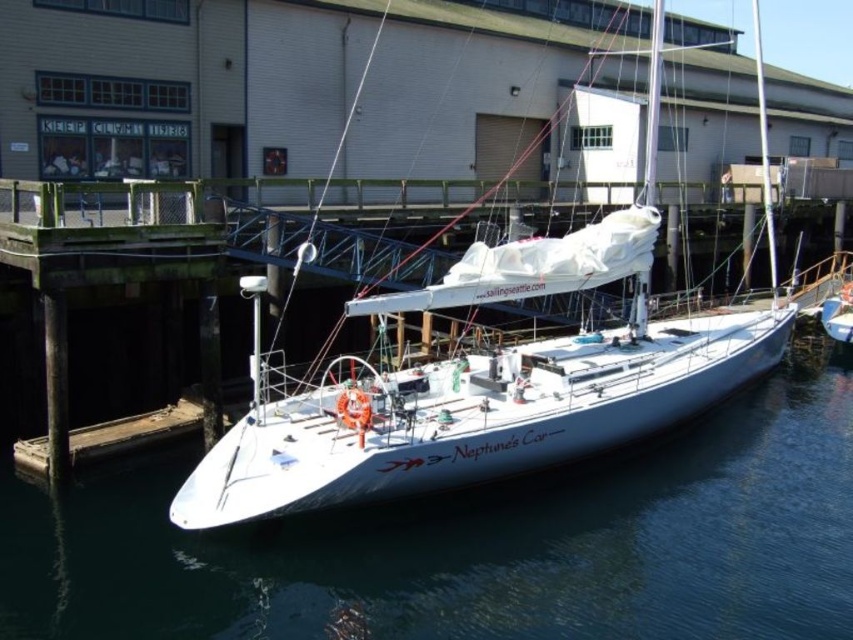
Question: Which of the following is the closest to the observer?

Choices:
 (A) click(x=786, y=208)
 (B) click(x=227, y=468)

Answer: (B)

Question: Which of these objects is positioned closest to the clear water at center?

Choices:
 (A) white glossy sailboat at center
 (B) wooden dock at lower left

Answer: (A)

Question: Among these points, which one is farthest from the camera?

Choices:
 (A) (838, 566)
 (B) (166, 250)
 (C) (311, 465)

Answer: (B)

Question: Can you confirm if white glossy sailboat at center is positioned to the left of wooden dock at lower left?

Choices:
 (A) no
 (B) yes

Answer: (A)

Question: Is white glossy sailboat at center above wooden dock at lower left?

Choices:
 (A) no
 (B) yes

Answer: (B)

Question: Does clear water at center appear under white glossy sailboat at center?

Choices:
 (A) no
 (B) yes

Answer: (B)